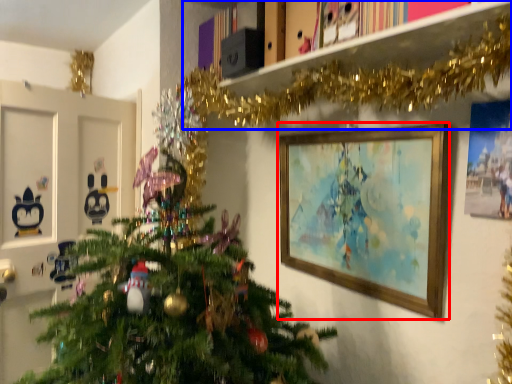
Question: Which object is closer to the camera taking this photo, picture frame (highlighted by a red box) or bookshelf (highlighted by a blue box)?

Choices:
 (A) picture frame
 (B) bookshelf

Answer: (B)